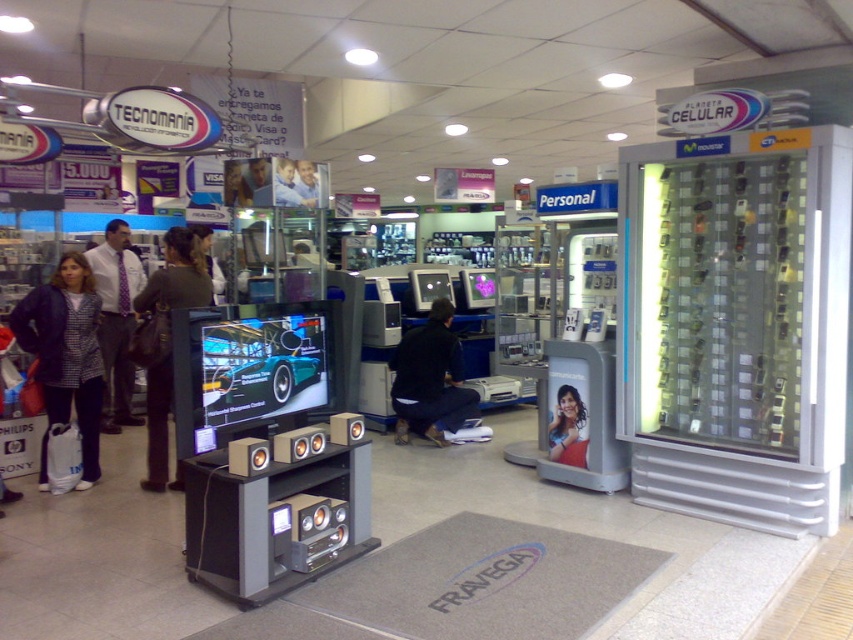
Question: Based on their relative distances, which object is nearer to the dark brown leather jacket at left?

Choices:
 (A) denim jacket at lower left
 (B) black matte clothing at center
 (C) dark brown leather jacket at center
 (D) plaid fabric jacket at left

Answer: (A)

Question: Which point is closer to the camera?

Choices:
 (A) (100, 374)
 (B) (102, 336)
 (C) (215, 284)
 (D) (454, 378)

Answer: (A)

Question: Can you confirm if shiny metallic car at center is positioned to the right of shiny blue hair at center?

Choices:
 (A) yes
 (B) no

Answer: (B)

Question: Which point is closer to the camera?

Choices:
 (A) black matte clothing at center
 (B) dark brown leather jacket at left
 (C) shiny metallic car at center

Answer: (C)

Question: From the image, what is the correct spatial relationship of plaid fabric jacket at left in relation to dark brown leather jacket at center?

Choices:
 (A) left
 (B) right

Answer: (A)

Question: Does denim jacket at lower left appear under shiny metallic car at center?

Choices:
 (A) no
 (B) yes

Answer: (B)